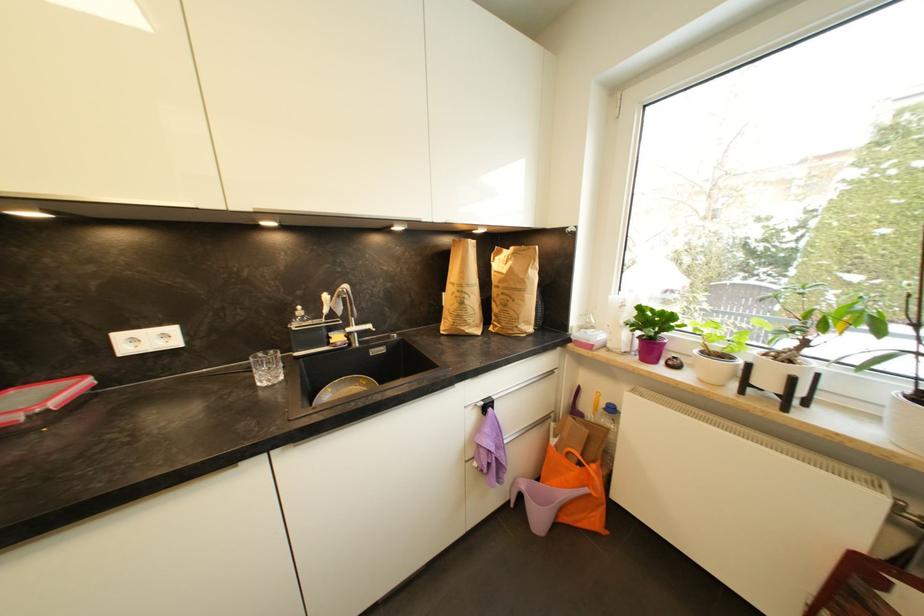
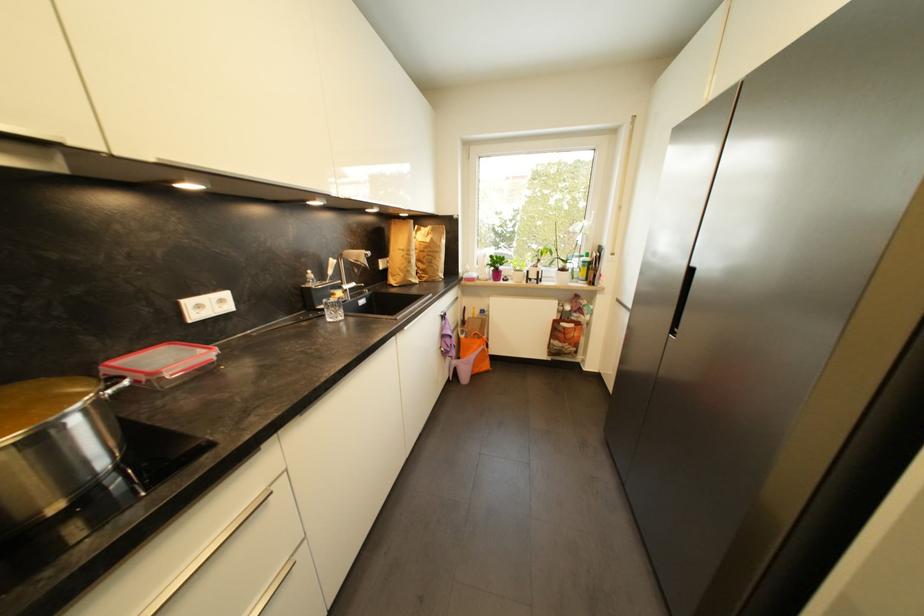
Find the pixel in the second image that matches (645,310) in the first image.

(495, 257)